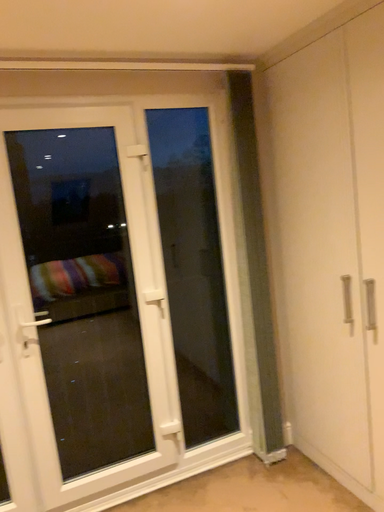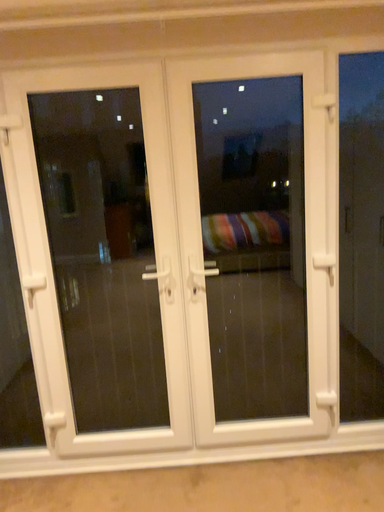
Question: How did the camera likely rotate when shooting the video?

Choices:
 (A) rotated right
 (B) rotated left

Answer: (B)